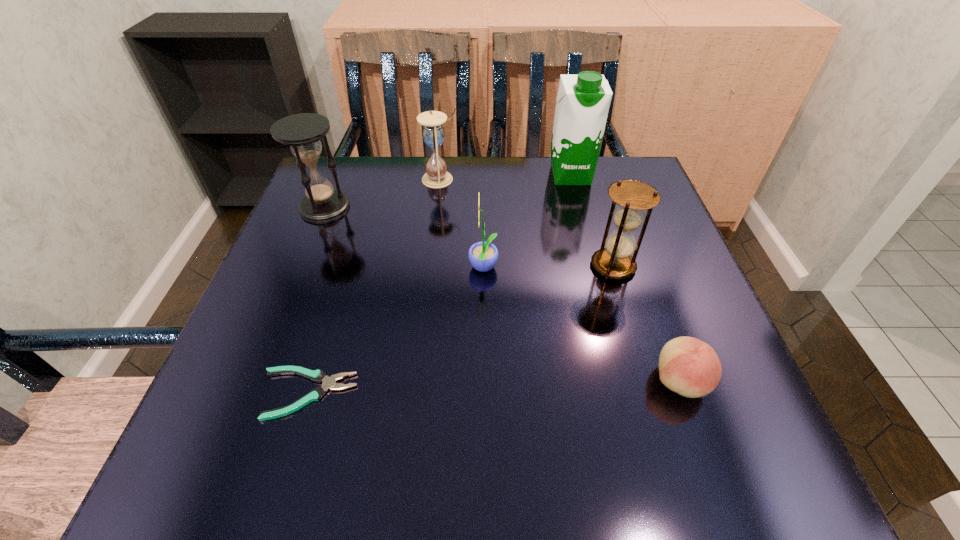
Where is `hourglass that is at the left edge`? The width and height of the screenshot is (960, 540). hourglass that is at the left edge is located at coordinates (302, 132).

This screenshot has width=960, height=540. I want to click on pliers at the left edge, so click(x=319, y=376).

Where is `soya milk that is at the right edge`? soya milk that is at the right edge is located at coordinates (582, 104).

Identify the location of hourglass that is at the right edge. (614, 261).

Locate an element on the screen. Image resolution: width=960 pixels, height=540 pixels. peach that is at the right edge is located at coordinates (688, 366).

What are the coordinates of `object positioned at the far left corner` in the screenshot? It's located at (302, 132).

Where is `object at the near left corner`? object at the near left corner is located at coordinates [319, 376].

Locate an element on the screen. The height and width of the screenshot is (540, 960). object at the far right corner is located at coordinates (582, 104).

Locate an element on the screen. The width and height of the screenshot is (960, 540). vacant space at the far edge of the desktop is located at coordinates (510, 159).

Where is `vacant position at the near edge of the desktop`? Image resolution: width=960 pixels, height=540 pixels. vacant position at the near edge of the desktop is located at coordinates (618, 480).